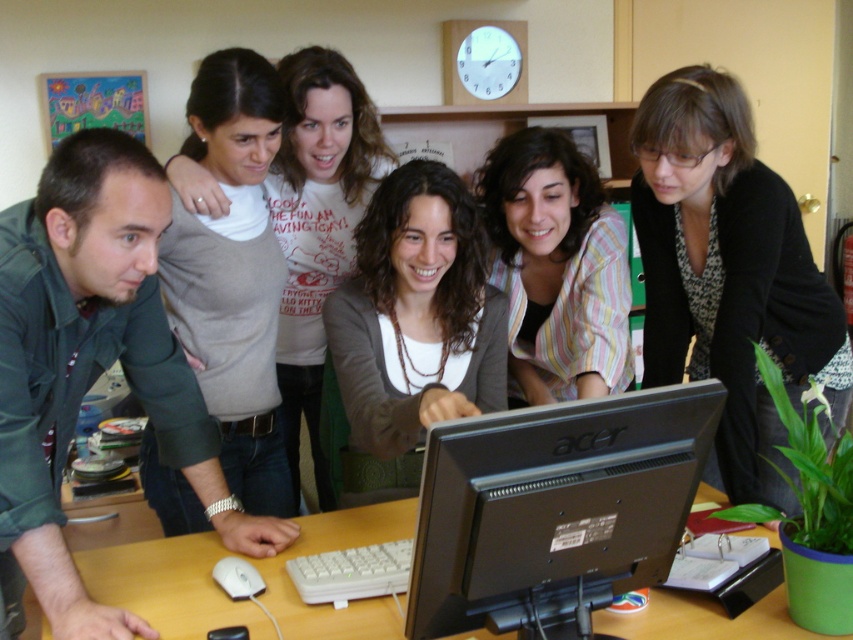
You are a person who wants to place a new cup on the wooden table at center without disturbing the brown matte sweater at center. Is the sweater currently on the table or above it?

The brown matte sweater at center is above wooden table at center, so placing the cup on the table would not disturb it since the sweater is not on the table but above it.

You are a person who wants to place a 15 cm tall paperweight on the wooden table at center. Can you do so without the paperweight touching the brown matte sweater at center?

The brown matte sweater at center is taller than the wooden table at center. Since the sweater is taller than the table, placing the paperweight on the table might cause it to be under the sweater. However, if there is enough space between the sweater and the table surface, the paperweight could be placed without touching it. But since the exact distance isn